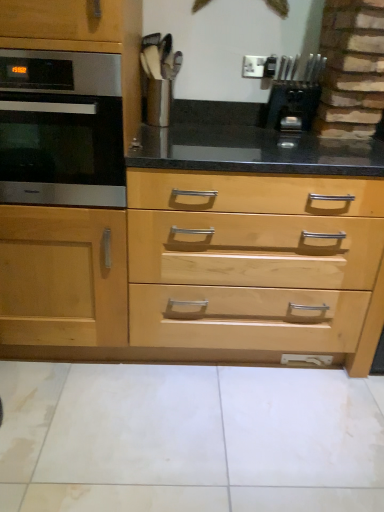
Question: From a real-world perspective, is satin black oven at left located beneath black plastic knife block at upper right?

Choices:
 (A) yes
 (B) no

Answer: (A)

Question: Does satin black oven at left have a larger size compared to black plastic knife block at upper right?

Choices:
 (A) yes
 (B) no

Answer: (A)

Question: Does satin black oven at left lie behind black plastic knife block at upper right?

Choices:
 (A) yes
 (B) no

Answer: (B)

Question: From the image's perspective, is satin black oven at left located beneath black plastic knife block at upper right?

Choices:
 (A) yes
 (B) no

Answer: (A)

Question: Is satin black oven at left closer to camera compared to black plastic knife block at upper right?

Choices:
 (A) no
 (B) yes

Answer: (B)

Question: Is satin black oven at left wider than black plastic knife block at upper right?

Choices:
 (A) no
 (B) yes

Answer: (B)

Question: From a real-world perspective, is natural wood drawer at center under satin black oven at left?

Choices:
 (A) yes
 (B) no

Answer: (A)

Question: Does natural wood drawer at center contain satin black oven at left?

Choices:
 (A) no
 (B) yes

Answer: (A)

Question: Considering the relative sizes of natural wood drawer at center and satin black oven at left in the image provided, is natural wood drawer at center wider than satin black oven at left?

Choices:
 (A) yes
 (B) no

Answer: (A)

Question: Is natural wood drawer at center positioned before satin black oven at left?

Choices:
 (A) no
 (B) yes

Answer: (A)

Question: Can you confirm if natural wood drawer at center is shorter than satin black oven at left?

Choices:
 (A) yes
 (B) no

Answer: (B)

Question: Is natural wood drawer at center thinner than satin black oven at left?

Choices:
 (A) yes
 (B) no

Answer: (B)

Question: Is black plastic knife block at upper right shorter than natural wood drawer at center?

Choices:
 (A) no
 (B) yes

Answer: (B)